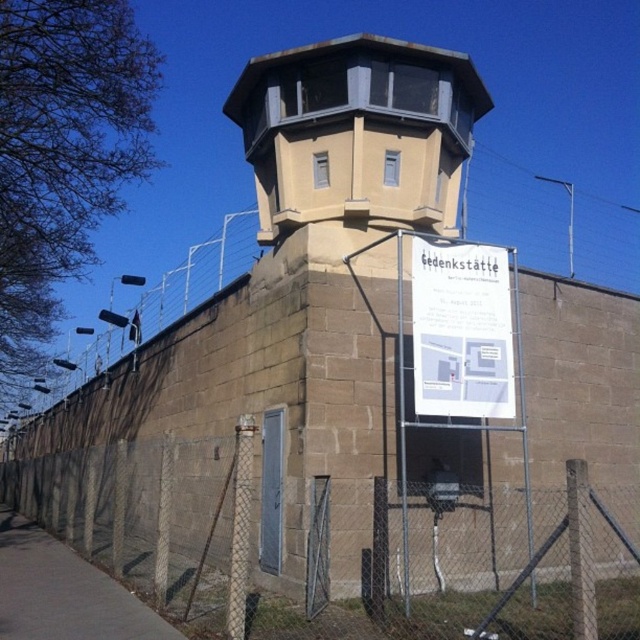
Which of these two, brown chain-link fence at lower center or beige concrete observation tower at upper center, stands taller?

brown chain-link fence at lower center

At what (x,y) coordinates should I click in order to perform the action: click on brown chain-link fence at lower center. Please return your answer as a coordinate pair (x, y). This screenshot has width=640, height=640. Looking at the image, I should click on (339, 550).

You are a GUI agent. You are given a task and a screenshot of the screen. Output one action in this format:
    pyautogui.click(x=<x>, y=<y>)
    Task: Click on the brown chain-link fence at lower center
    
    Given the screenshot: What is the action you would take?
    pyautogui.click(x=339, y=550)

Is beige concrete observation tower at upper center smaller than white paper sign at center?

Correct, beige concrete observation tower at upper center occupies less space than white paper sign at center.

The image size is (640, 640). I want to click on beige concrete observation tower at upper center, so click(x=356, y=132).

Does point (417, 541) come behind point (433, 388)?

Yes.

Does brown chain-link fence at lower center have a smaller size compared to white paper sign at center?

Result: No, brown chain-link fence at lower center is not smaller than white paper sign at center.

Image resolution: width=640 pixels, height=640 pixels. I want to click on brown chain-link fence at lower center, so click(x=339, y=550).